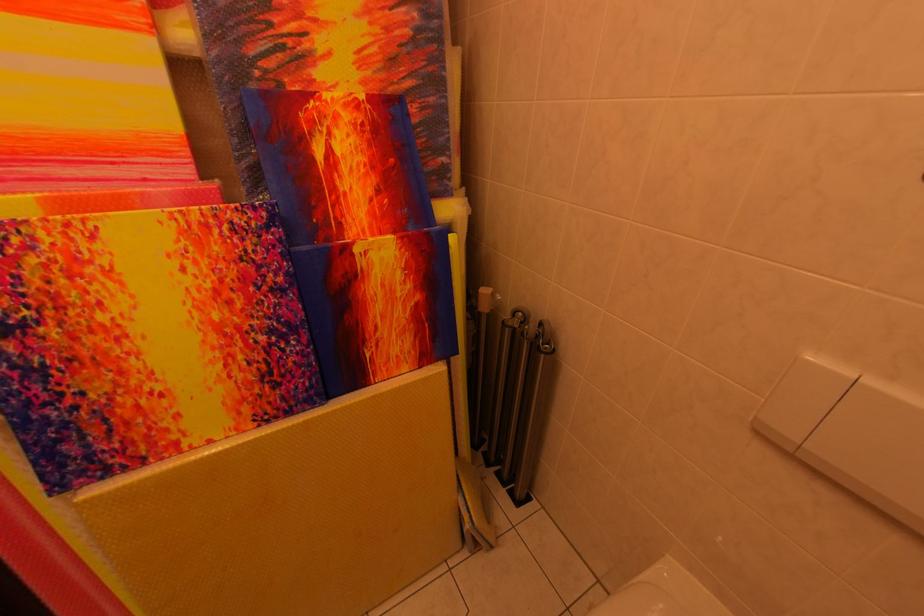
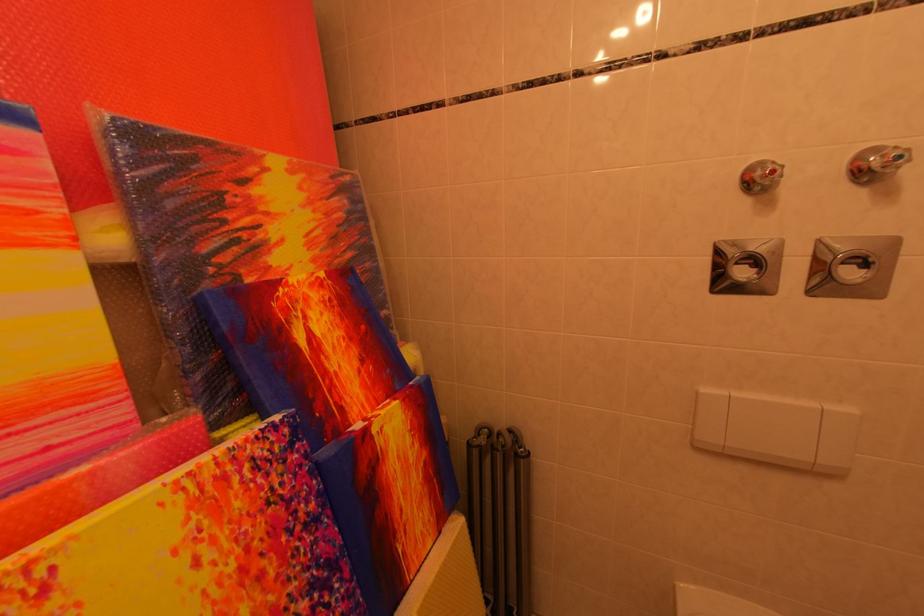
In the second image, find the point that corresponds to point 280,29 in the first image.

(233, 225)